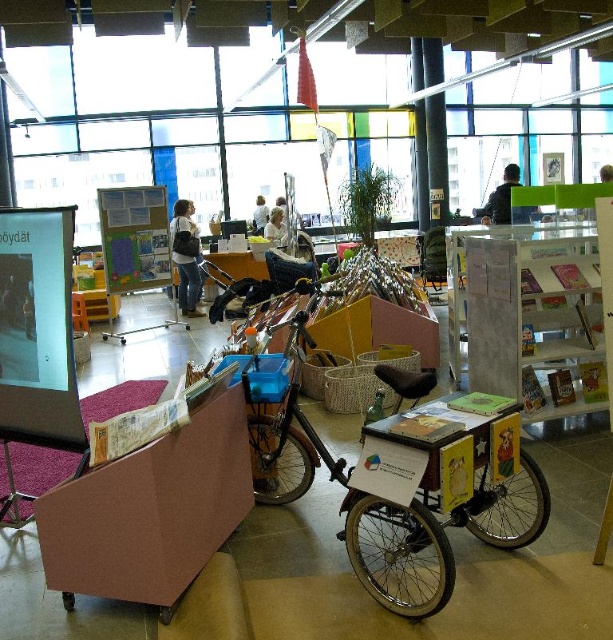
Consider the image. Who is positioned more to the right, dark blue jacket at upper center or light brown hair at center?

Positioned to the right is dark blue jacket at upper center.

Looking at this image, can you confirm if dark blue jacket at upper center is positioned to the right of light brown hair at center?

Indeed, dark blue jacket at upper center is positioned on the right side of light brown hair at center.

Between point (484, 211) and point (275, 225), which one is positioned in front?

Point (484, 211) is more forward.

Find the location of a particular element. The image size is (613, 640). dark blue jacket at upper center is located at coordinates (501, 196).

Is pink cardboard box at lower left to the left of light brown leather jacket at upper center from the viewer's perspective?

No, pink cardboard box at lower left is not to the left of light brown leather jacket at upper center.

From the picture: Measure the distance between pink cardboard box at lower left and camera.

A distance of 6.81 feet exists between pink cardboard box at lower left and camera.

Where is `pink cardboard box at lower left`? This screenshot has width=613, height=640. pink cardboard box at lower left is located at coordinates (150, 512).

The width and height of the screenshot is (613, 640). In order to click on pink cardboard box at lower left in this screenshot , I will do coord(150,512).

Who is more forward, (237, 476) or (489, 221)?

Point (237, 476) is in front.

Is point (110, 561) behind point (531, 208)?

No, it is in front of (531, 208).

Identify the location of pink cardboard box at lower left. This screenshot has width=613, height=640. (150, 512).